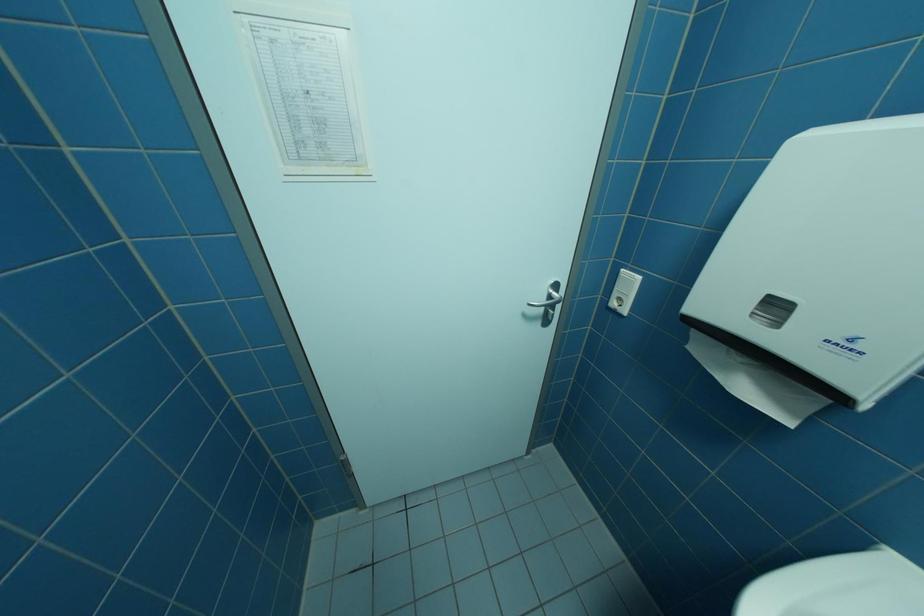
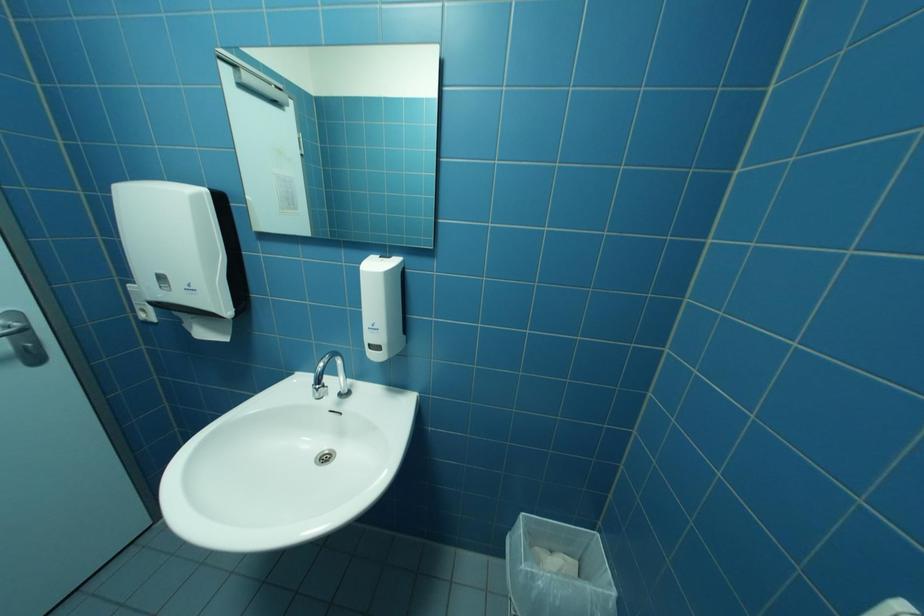
Question: The first image is from the beginning of the video and the second image is from the end. How did the camera likely rotate when shooting the video?

Choices:
 (A) Left
 (B) Right
 (C) Up
 (D) Down

Answer: (B)